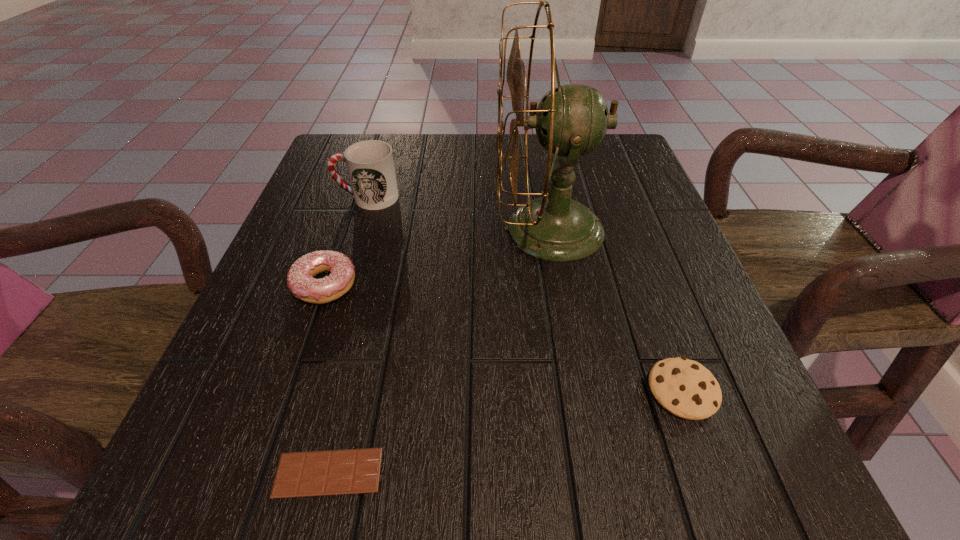
This screenshot has width=960, height=540. Identify the location of vacant space that satisfies the following two spatial constraints: 1. on the back side of the third tallest object; 2. on the side of the cup where the handle is located. pos(355,197).

The height and width of the screenshot is (540, 960). I want to click on vacant space that satisfies the following two spatial constraints: 1. in front of the fourth tallest object, directing air flow; 2. on the right side of the tallest object, so click(x=579, y=390).

Where is `vacant space that satisfies the following two spatial constraints: 1. on the front side of the doughnut; 2. on the right side of the shortest object`? Image resolution: width=960 pixels, height=540 pixels. vacant space that satisfies the following two spatial constraints: 1. on the front side of the doughnut; 2. on the right side of the shortest object is located at coordinates (260, 472).